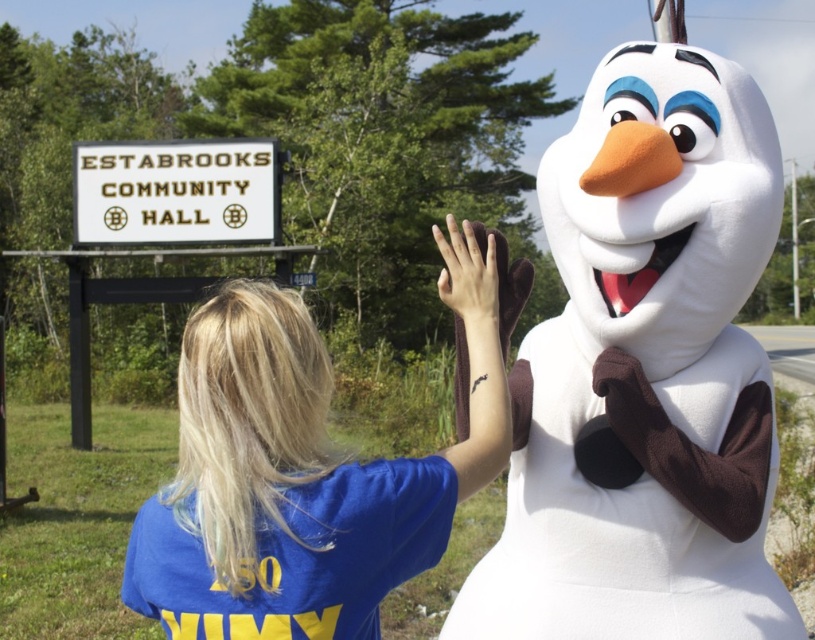
You are a photographer who wants to capture a photo where the white plush snowman at center and the blue cotton shirt at center are both clearly visible. Based on their positions, which object should you focus on first to ensure both are in frame?

The white plush snowman at center is located below the blue cotton shirt at center, so you should focus on the blue cotton shirt at center first to ensure both are in frame.

You are standing in an outdoor area and see the white plush snowman at center. If you want to take a photo of it with your phone, which has a minimum focus distance of 5 feet, will you need to move closer or farther away?

The white plush snowman at center is 8.02 feet away from you. Since your phone requires a minimum focus distance of 5 feet, you are already within the required range. Therefore, you do not need to move closer or farther away to take a clear photo.